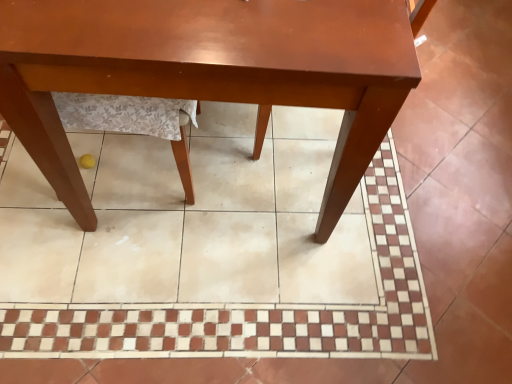
Find the location of a particular element. The height and width of the screenshot is (384, 512). matte wood table at center is located at coordinates (208, 71).

Measure the distance between point (399, 59) and camera.

They are 74.20 centimeters apart.

The width and height of the screenshot is (512, 384). What do you see at coordinates (208, 71) in the screenshot?
I see `matte wood table at center` at bounding box center [208, 71].

This screenshot has height=384, width=512. I want to click on brown glossy tile at center, so click(x=211, y=251).

The width and height of the screenshot is (512, 384). What do you see at coordinates (211, 251) in the screenshot?
I see `brown glossy tile at center` at bounding box center [211, 251].

Where is `matte wood table at center`? The height and width of the screenshot is (384, 512). matte wood table at center is located at coordinates click(208, 71).

Looking at this image, considering the relative positions of matte wood table at center and brown glossy tile at center in the image provided, is matte wood table at center to the right of brown glossy tile at center from the viewer's perspective?

In fact, matte wood table at center is to the left of brown glossy tile at center.

From the picture: Who is more distant, matte wood table at center or brown glossy tile at center?

brown glossy tile at center is more distant.

Which point is more forward, (x=271, y=61) or (x=311, y=218)?

Positioned in front is point (x=271, y=61).

From the image's perspective, would you say matte wood table at center is shown under brown glossy tile at center?

Incorrect, from the image's perspective, matte wood table at center is higher than brown glossy tile at center.

From a real-world perspective, who is located lower, matte wood table at center or brown glossy tile at center?

brown glossy tile at center is physically lower.

Which object is wider, matte wood table at center or brown glossy tile at center?

brown glossy tile at center.

Can you confirm if matte wood table at center is taller than brown glossy tile at center?

Yes.

Looking at this image, in terms of size, does matte wood table at center appear bigger or smaller than brown glossy tile at center?

matte wood table at center is bigger than brown glossy tile at center.

Is matte wood table at center located outside brown glossy tile at center?

matte wood table at center is positioned outside brown glossy tile at center.

Is matte wood table at center directly adjacent to brown glossy tile at center?

No, matte wood table at center is not in contact with brown glossy tile at center.

Is matte wood table at center oriented towards brown glossy tile at center?

No, matte wood table at center does not turn towards brown glossy tile at center.

Can you tell me how much matte wood table at center and brown glossy tile at center differ in facing direction?

There is a 178-degree angle between the facing directions of matte wood table at center and brown glossy tile at center.

The height and width of the screenshot is (384, 512). In order to click on ceramic tile on the right of matte wood table at center in this screenshot , I will do `click(211, 251)`.

Can you confirm if brown glossy tile at center is positioned to the left of matte wood table at center?

No.

Considering the relative positions of brown glossy tile at center and matte wood table at center in the image provided, is brown glossy tile at center in front of matte wood table at center?

No, brown glossy tile at center is further to the viewer.

Is point (308, 273) closer to viewer compared to point (44, 153)?

No, it is behind (44, 153).

From the image's perspective, is brown glossy tile at center above or below matte wood table at center?

Based on their image positions, brown glossy tile at center is located beneath matte wood table at center.

From a real-world perspective, relative to matte wood table at center, is brown glossy tile at center vertically above or below?

brown glossy tile at center is below matte wood table at center.

From the picture: Which of these two, brown glossy tile at center or matte wood table at center, is wider?

brown glossy tile at center.

From the picture: Considering the sizes of objects brown glossy tile at center and matte wood table at center in the image provided, who is taller, brown glossy tile at center or matte wood table at center?

matte wood table at center.

Between brown glossy tile at center and matte wood table at center, which one has smaller size?

Smaller between the two is brown glossy tile at center.

Is brown glossy tile at center located outside matte wood table at center?

Absolutely, brown glossy tile at center is external to matte wood table at center.

Would you say brown glossy tile at center is a long distance from matte wood table at center?

That's not correct — brown glossy tile at center is a little close to matte wood table at center.

Is brown glossy tile at center facing towards matte wood table at center?

Yes, brown glossy tile at center is turned towards matte wood table at center.

Can you tell me how much brown glossy tile at center and matte wood table at center differ in facing direction?

178 degrees separate the facing orientations of brown glossy tile at center and matte wood table at center.

Image resolution: width=512 pixels, height=384 pixels. I want to click on ceramic tile below the matte wood table at center (from the image's perspective), so click(x=211, y=251).

Find the location of a particular element. The height and width of the screenshot is (384, 512). ceramic tile that appears below the matte wood table at center (from a real-world perspective) is located at coordinates (211, 251).

The image size is (512, 384). I want to click on ceramic tile behind the matte wood table at center, so click(211, 251).